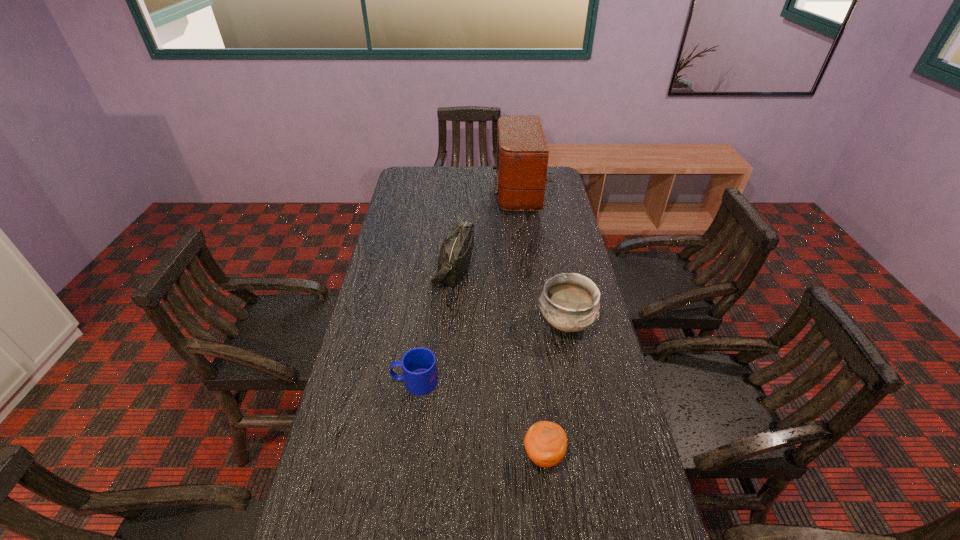
The image size is (960, 540). I want to click on radio receiver at the right edge, so click(522, 152).

Where is `pottery that is positioned at the right edge`? This screenshot has height=540, width=960. pottery that is positioned at the right edge is located at coordinates (569, 301).

Image resolution: width=960 pixels, height=540 pixels. I want to click on object positioned at the far right corner, so click(522, 152).

In the image, there is a desktop. Where is `vacant space at the far edge`? vacant space at the far edge is located at coordinates (487, 168).

This screenshot has width=960, height=540. In order to click on vacant area at the left edge in this screenshot , I will do `click(398, 202)`.

Where is `vacant area at the right edge of the desktop`? Image resolution: width=960 pixels, height=540 pixels. vacant area at the right edge of the desktop is located at coordinates (574, 259).

Locate an element on the screen. Image resolution: width=960 pixels, height=540 pixels. free space at the far right corner is located at coordinates (555, 184).

This screenshot has height=540, width=960. Identify the location of free space between the mug and the third farthest object. (491, 353).

In order to click on free space between the third shortest object and the orange in this screenshot , I will do `click(555, 389)`.

At what (x,y) coordinates should I click in order to perform the action: click on free space between the tallest object and the orange. Please return your answer as a coordinate pair (x, y). Looking at the image, I should click on (536, 324).